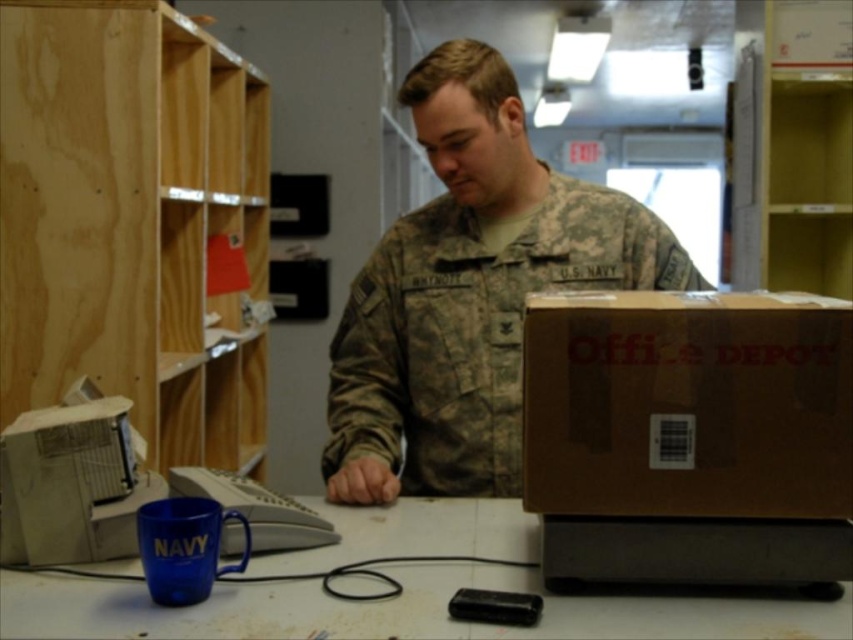
You are a photographer taking a picture of the scene. You notice two points in the image at coordinates point (x=149, y=294) and point (x=519, y=568). Which point is closer to the camera?

Point (x=149, y=294) is further to the camera than point (x=519, y=568), so the point closer to the camera is point (x=519, y=568).

You are organizing items on a desk and need to place a new item between the light wood bookshelf at left and the blue plastic cup at lower center. Which side of the bookshelf should you place it closer to ensure it fits within the available space?

The light wood bookshelf at left is thinner than the blue plastic cup at lower center, so you should place the new item closer to the blue plastic cup at lower center side to ensure it fits within the available space.